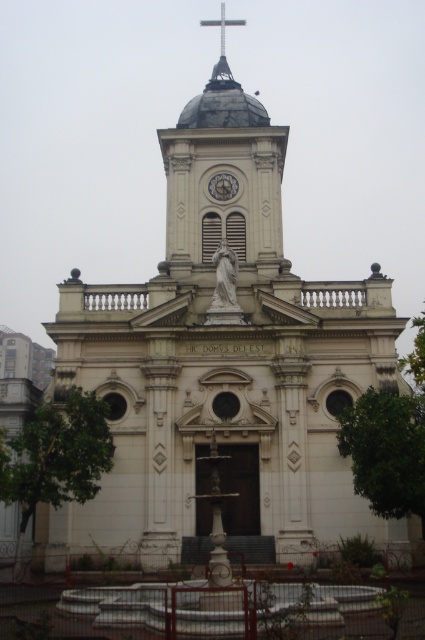
Question: Can you confirm if metallic clock at center is positioned to the left of metallic cross at upper center?

Choices:
 (A) yes
 (B) no

Answer: (B)

Question: Among these points, which one is farthest from the camera?

Choices:
 (A) (243, 20)
 (B) (221, 173)

Answer: (A)

Question: Does metallic clock at center have a larger size compared to metallic cross at upper center?

Choices:
 (A) yes
 (B) no

Answer: (B)

Question: Does metallic clock at center appear over metallic cross at upper center?

Choices:
 (A) no
 (B) yes

Answer: (A)

Question: Among these points, which one is nearest to the camera?

Choices:
 (A) (221, 189)
 (B) (226, 19)

Answer: (A)